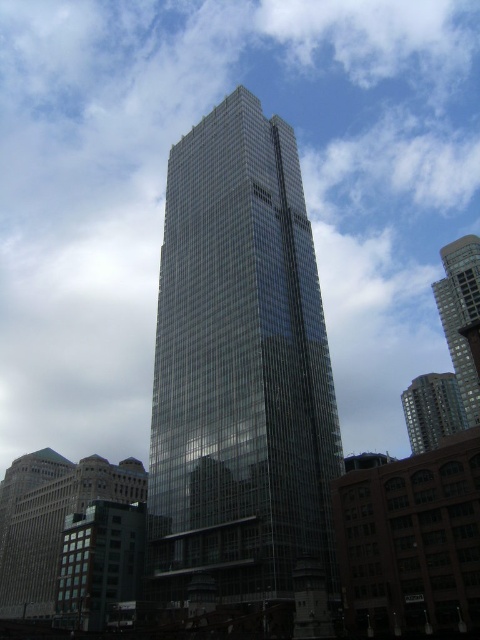
Is glassy skyscraper at center smaller than glassy reflective building at right?

Incorrect, glassy skyscraper at center is not smaller in size than glassy reflective building at right.

Between point (468, 387) and point (455, 406), which one is positioned behind?

The point (455, 406) is behind.

The image size is (480, 640). In order to click on glassy skyscraper at center in this screenshot , I will do `click(460, 314)`.

Who is taller, transparent glass skyscraper at center or glassy reflective building at right?

With more height is transparent glass skyscraper at center.

At what (x,y) coordinates should I click in order to perform the action: click on transparent glass skyscraper at center. Please return your answer as a coordinate pair (x, y). Looking at the image, I should click on pyautogui.click(x=239, y=371).

Locate an element on the screen. The image size is (480, 640). transparent glass skyscraper at center is located at coordinates (239, 371).

Who is higher up, transparent glass skyscraper at center or glassy skyscraper at center?

glassy skyscraper at center is higher up.

Who is taller, transparent glass skyscraper at center or glassy skyscraper at center?

Standing taller between the two is transparent glass skyscraper at center.

Between point (202, 497) and point (432, 284), which one is positioned behind?

The point (432, 284) is behind.

Where is `transparent glass skyscraper at center`? transparent glass skyscraper at center is located at coordinates (239, 371).